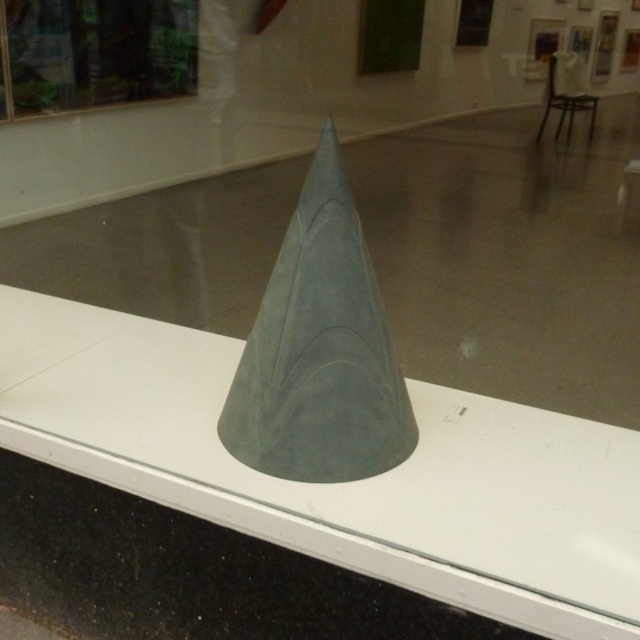
Can you confirm if transparent glass cone at center is shorter than suede gray cone at center?

Correct, transparent glass cone at center is not as tall as suede gray cone at center.

Who is higher up, transparent glass cone at center or suede gray cone at center?

Positioned higher is suede gray cone at center.

Between point (326, 552) and point (346, 314), which one is positioned in front?

Point (326, 552) is more forward.

Locate an element on the screen. transparent glass cone at center is located at coordinates (340, 483).